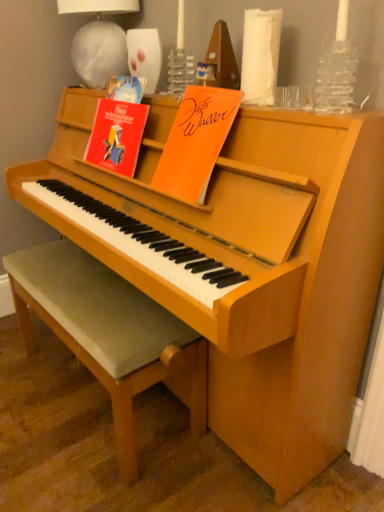
What do you see at coordinates (196, 142) in the screenshot? I see `orange paper at upper center, which appears as the first paperback book when viewed from the right` at bounding box center [196, 142].

Measure the distance between point (197, 118) and camera.

Point (197, 118) and camera are 3.82 feet apart.

Locate an element on the screen. red paper at upper left, which is counted as the 1th paperback book, starting from the left is located at coordinates (116, 136).

Considering the relative sizes of red paper at upper left, which is counted as the second paperback book, starting from the right, and light brown wooden stool at center in the image provided, is red paper at upper left, which is counted as the second paperback book, starting from the right, smaller than light brown wooden stool at center?

Yes.

From their relative heights in the image, would you say red paper at upper left, which is counted as the 1th paperback book, starting from the left, is taller or shorter than light brown wooden stool at center?

red paper at upper left, which is counted as the 1th paperback book, starting from the left, is shorter than light brown wooden stool at center.

Is red paper at upper left, which is counted as the 1th paperback book, starting from the left, positioned before light brown wooden stool at center?

No, red paper at upper left, which is counted as the 1th paperback book, starting from the left, is further to the viewer.

Is orange paper at upper center, which appears as the first paperback book when viewed from the right, facing away from light brown wooden stool at center?

orange paper at upper center, which appears as the first paperback book when viewed from the right, does not have its back to light brown wooden stool at center.

Is orange paper at upper center, which is counted as the 2th paperback book, starting from the left, bigger or smaller than light brown wooden stool at center?

A: Considering their sizes, orange paper at upper center, which is counted as the 2th paperback book, starting from the left, takes up less space than light brown wooden stool at center.

Which is more to the left, orange paper at upper center, which is counted as the 2th paperback book, starting from the left, or light brown wooden stool at center?

light brown wooden stool at center.

In the scene shown: Is orange paper at upper center, which appears as the first paperback book when viewed from the right, directly adjacent to light brown wooden stool at center?

No, orange paper at upper center, which appears as the first paperback book when viewed from the right, is not touching light brown wooden stool at center.

Which of these two, light brown wooden stool at center or white fabric lampshade at upper center, is wider?

light brown wooden stool at center.

From the picture: In terms of height, does light brown wooden stool at center look taller or shorter compared to white fabric lampshade at upper center?

Clearly, light brown wooden stool at center is taller compared to white fabric lampshade at upper center.

Would you say light brown wooden stool at center is a long distance from white fabric lampshade at upper center?

No, there isn't a large distance between light brown wooden stool at center and white fabric lampshade at upper center.

In the image, there is a white fabric lampshade at upper center. Identify the location of stool below it (from the image's perspective). (110, 334).

Is white fabric lampshade at upper center not near red paper at upper left, which is counted as the 1th paperback book, starting from the left?

Actually, white fabric lampshade at upper center and red paper at upper left, which is counted as the 1th paperback book, starting from the left, are a little close together.

Is white fabric lampshade at upper center completely or partially outside of red paper at upper left, which is counted as the second paperback book, starting from the right?

Yes, white fabric lampshade at upper center is outside of red paper at upper left, which is counted as the second paperback book, starting from the right.

From the image's perspective, who appears lower, white fabric lampshade at upper center or red paper at upper left, which is counted as the 1th paperback book, starting from the left?

From the image's view, red paper at upper left, which is counted as the 1th paperback book, starting from the left, is below.

Which object is thinner, white fabric lampshade at upper center or red paper at upper left, which is counted as the second paperback book, starting from the right?

red paper at upper left, which is counted as the second paperback book, starting from the right.

Is white fabric lampshade at upper center at the right side of light brown wooden stool at center?

No.

Considering the sizes of objects white fabric lampshade at upper center and light brown wooden stool at center in the image provided, who is shorter, white fabric lampshade at upper center or light brown wooden stool at center?

white fabric lampshade at upper center is shorter.

Can you confirm if white fabric lampshade at upper center is wider than light brown wooden stool at center?

No, white fabric lampshade at upper center is not wider than light brown wooden stool at center.

From the image's perspective, between white fabric lampshade at upper center and light brown wooden stool at center, which one is located above?

white fabric lampshade at upper center, from the image's perspective.

Which of these two, light brown wooden stool at center or orange paper at upper center, which appears as the first paperback book when viewed from the right, is bigger?

With larger size is light brown wooden stool at center.

From the image's perspective, which is below, light brown wooden stool at center or orange paper at upper center, which appears as the first paperback book when viewed from the right?

light brown wooden stool at center, from the image's perspective.

Can you see light brown wooden stool at center touching orange paper at upper center, which appears as the first paperback book when viewed from the right?

No, light brown wooden stool at center is not making contact with orange paper at upper center, which appears as the first paperback book when viewed from the right.

Is orange paper at upper center, which is counted as the 2th paperback book, starting from the left, outside of red paper at upper left, which is counted as the 1th paperback book, starting from the left?

orange paper at upper center, which is counted as the 2th paperback book, starting from the left, is positioned outside red paper at upper left, which is counted as the 1th paperback book, starting from the left.

Are orange paper at upper center, which appears as the first paperback book when viewed from the right, and red paper at upper left, which is counted as the second paperback book, starting from the right, located far from each other?

No.

Can you tell me how much orange paper at upper center, which appears as the first paperback book when viewed from the right, and red paper at upper left, which is counted as the 1th paperback book, starting from the left, differ in facing direction?

1.89 degrees.

Which is nearer, [221,135] or [125,106]?

Point [221,135]

Locate an element on the screen. This screenshot has height=512, width=384. paperback book behind the light brown wooden stool at center is located at coordinates (116, 136).

Locate an element on the screen. The image size is (384, 512). stool below the orange paper at upper center, which appears as the first paperback book when viewed from the right (from the image's perspective) is located at coordinates (110, 334).

Considering their positions, is orange paper at upper center, which is counted as the 2th paperback book, starting from the left, positioned closer to light brown wooden stool at center than red paper at upper left, which is counted as the second paperback book, starting from the right?

red paper at upper left, which is counted as the second paperback book, starting from the right, is closer to light brown wooden stool at center.

Looking at the image, which one is located further to red paper at upper left, which is counted as the 1th paperback book, starting from the left, white fabric lampshade at upper center or orange paper at upper center, which is counted as the 2th paperback book, starting from the left?

Based on the image, white fabric lampshade at upper center appears to be further to red paper at upper left, which is counted as the 1th paperback book, starting from the left.

Based on their spatial positions, is red paper at upper left, which is counted as the 1th paperback book, starting from the left, or orange paper at upper center, which appears as the first paperback book when viewed from the right, further from light brown wooden stool at center?

orange paper at upper center, which appears as the first paperback book when viewed from the right, lies further to light brown wooden stool at center than the other object.

Based on their spatial positions, is white fabric lampshade at upper center or red paper at upper left, which is counted as the second paperback book, starting from the right, closer to light brown wooden stool at center?

red paper at upper left, which is counted as the second paperback book, starting from the right, is closer to light brown wooden stool at center.

Which object lies nearer to the anchor point red paper at upper left, which is counted as the second paperback book, starting from the right, white fabric lampshade at upper center or light brown wooden stool at center?

The object closer to red paper at upper left, which is counted as the second paperback book, starting from the right, is white fabric lampshade at upper center.

Looking at the image, which one is located closer to light brown wooden stool at center, red paper at upper left, which is counted as the 1th paperback book, starting from the left, or white fabric lampshade at upper center?

The object closer to light brown wooden stool at center is red paper at upper left, which is counted as the 1th paperback book, starting from the left.

Looking at the image, which one is located further to white fabric lampshade at upper center, red paper at upper left, which is counted as the second paperback book, starting from the right, or orange paper at upper center, which appears as the first paperback book when viewed from the right?

Based on the image, orange paper at upper center, which appears as the first paperback book when viewed from the right, appears to be further to white fabric lampshade at upper center.

From the image, which object appears to be nearer to light brown wooden stool at center, white fabric lampshade at upper center or orange paper at upper center, which is counted as the 2th paperback book, starting from the left?

The object closer to light brown wooden stool at center is orange paper at upper center, which is counted as the 2th paperback book, starting from the left.

Where is `paperback book between white fabric lampshade at upper center and orange paper at upper center, which appears as the first paperback book when viewed from the right, vertically`? The height and width of the screenshot is (512, 384). paperback book between white fabric lampshade at upper center and orange paper at upper center, which appears as the first paperback book when viewed from the right, vertically is located at coordinates (116, 136).

This screenshot has width=384, height=512. Find the location of `paperback book between red paper at upper left, which is counted as the second paperback book, starting from the right, and light brown wooden stool at center, in the vertical direction`. paperback book between red paper at upper left, which is counted as the second paperback book, starting from the right, and light brown wooden stool at center, in the vertical direction is located at coordinates (196, 142).